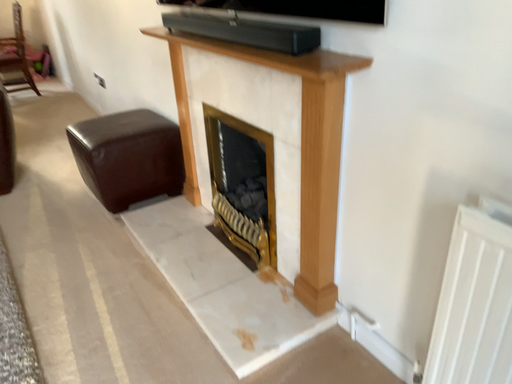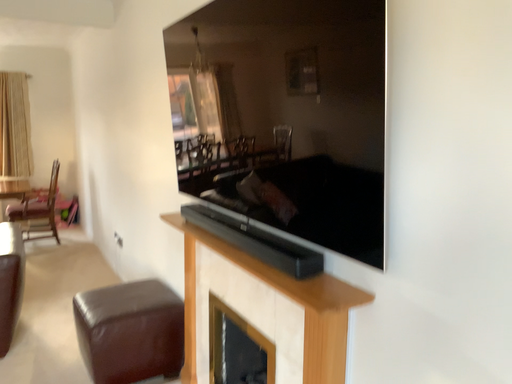
Question: Which way did the camera rotate in the video?

Choices:
 (A) rotated downward
 (B) rotated upward

Answer: (B)